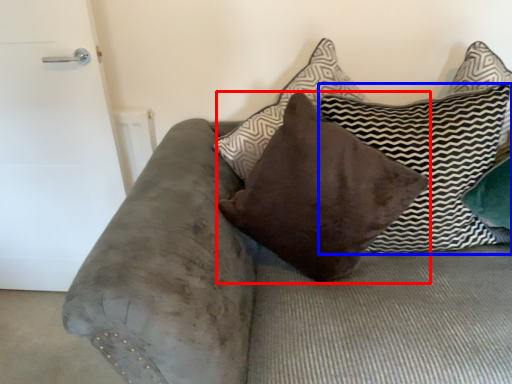
Question: Among these objects, which one is nearest to the camera, pillow (highlighted by a red box) or pillow (highlighted by a blue box)?

Choices:
 (A) pillow
 (B) pillow

Answer: (B)